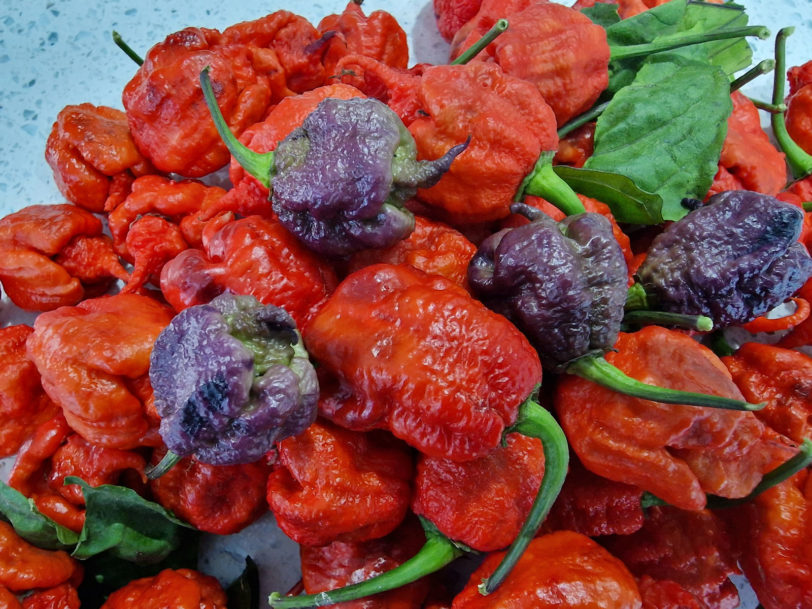
Where is `empty blue counter space`? The height and width of the screenshot is (609, 812). empty blue counter space is located at coordinates (80, 22).